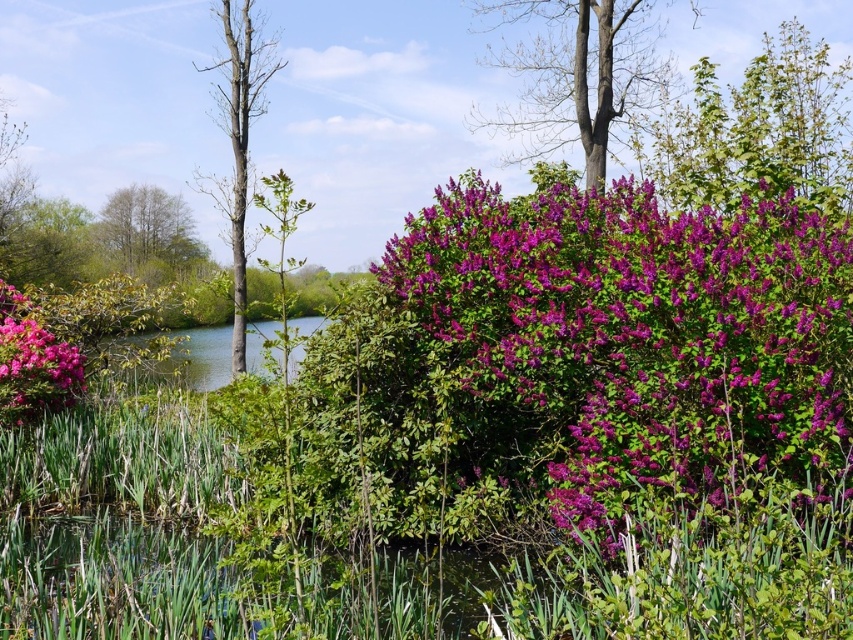
Question: Does purple glossy bush at center have a smaller size compared to purple leafy bush at upper right?

Choices:
 (A) no
 (B) yes

Answer: (B)

Question: Which point is farther from the camera taking this photo?

Choices:
 (A) (257, 35)
 (B) (792, 392)
 (C) (44, 339)
 (D) (177, 244)

Answer: (D)

Question: Is purple glossy bush at center above smooth bark tree at upper center?

Choices:
 (A) yes
 (B) no

Answer: (B)

Question: Which point is farther to the camera?

Choices:
 (A) purple leafy bush at upper right
 (B) green leafy tree at upper left
 (C) smooth bark tree at upper center

Answer: (B)

Question: Based on their relative distances, which object is farther from the purple glossy bush at center?

Choices:
 (A) green leafy tree at upper left
 (B) smooth bark tree at upper center
 (C) matte pink flower at lower left

Answer: (A)

Question: Is smooth bark tree at upper center behind matte pink flower at lower left?

Choices:
 (A) no
 (B) yes

Answer: (B)